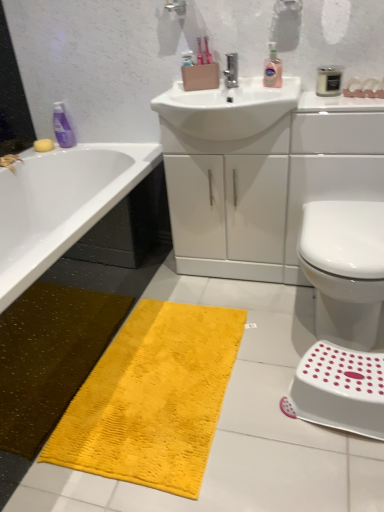
Question: Is white glossy sink at center to the right of yellow sponge at upper left from the viewer's perspective?

Choices:
 (A) no
 (B) yes

Answer: (B)

Question: From a real-world perspective, does white glossy sink at center sit lower than yellow sponge at upper left?

Choices:
 (A) no
 (B) yes

Answer: (B)

Question: Can yellow sponge at upper left be found inside white glossy sink at center?

Choices:
 (A) yes
 (B) no

Answer: (B)

Question: Is there a large distance between white glossy sink at center and yellow sponge at upper left?

Choices:
 (A) no
 (B) yes

Answer: (B)

Question: Is the depth of white glossy sink at center less than that of yellow sponge at upper left?

Choices:
 (A) no
 (B) yes

Answer: (B)

Question: From the image's perspective, would you say white glossy sink at center is shown under yellow sponge at upper left?

Choices:
 (A) no
 (B) yes

Answer: (B)

Question: Is white glossy bidet at lower right touching white glossy sink at center?

Choices:
 (A) no
 (B) yes

Answer: (A)

Question: Does white glossy bidet at lower right have a lesser width compared to white glossy sink at center?

Choices:
 (A) yes
 (B) no

Answer: (B)

Question: Is white glossy sink at center completely or partially inside white glossy bidet at lower right?

Choices:
 (A) no
 (B) yes

Answer: (A)

Question: From the image's perspective, is white glossy bidet at lower right beneath white glossy sink at center?

Choices:
 (A) no
 (B) yes

Answer: (B)

Question: Is white glossy bidet at lower right positioned behind white glossy sink at center?

Choices:
 (A) no
 (B) yes

Answer: (A)

Question: Could you tell me if white glossy bidet at lower right is facing white glossy sink at center?

Choices:
 (A) yes
 (B) no

Answer: (B)

Question: From the image's perspective, is white plastic step stool at lower right under white glossy bidet at lower right?

Choices:
 (A) yes
 (B) no

Answer: (A)